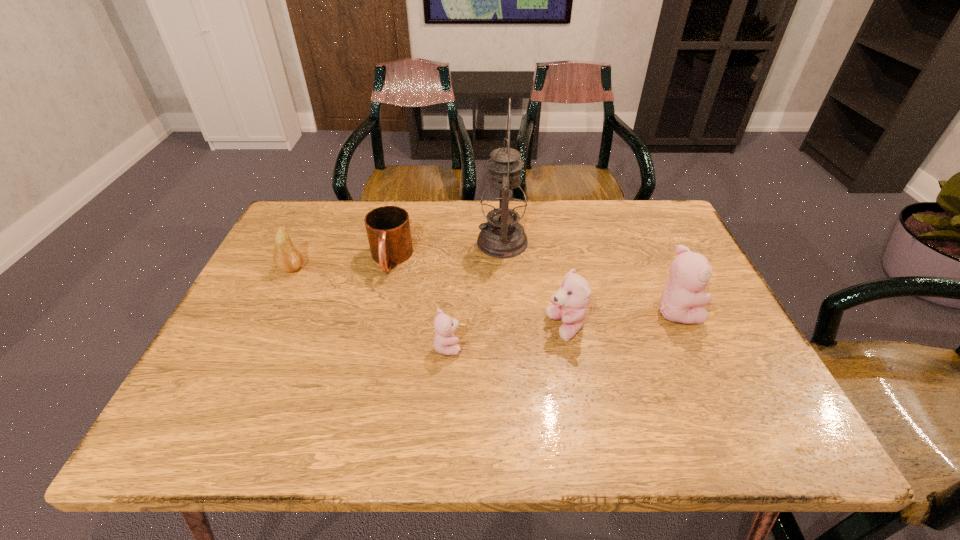
Please point a spot on the left to add another teddy bear. Please provide its 2D coordinates. Your answer should be formatted as a tuple, i.e. [(x, y)], where the tuple contains the x and y coordinates of a point satisfying the conditions above.

[(319, 366)]